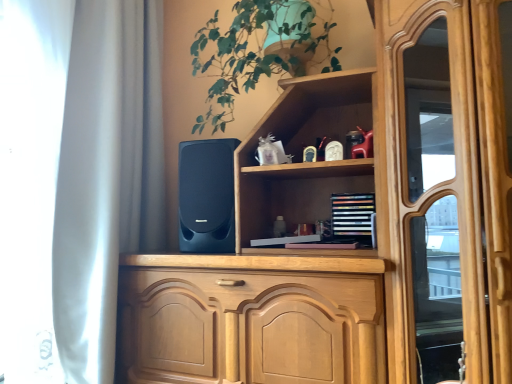
Question: Is the position of green leafy plant at upper center more distant than that of multicolored wooden bookshelf at upper center?

Choices:
 (A) yes
 (B) no

Answer: (B)

Question: Considering the relative sizes of green leafy plant at upper center and multicolored wooden bookshelf at upper center in the image provided, is green leafy plant at upper center taller than multicolored wooden bookshelf at upper center?

Choices:
 (A) yes
 (B) no

Answer: (A)

Question: Does green leafy plant at upper center appear on the left side of multicolored wooden bookshelf at upper center?

Choices:
 (A) yes
 (B) no

Answer: (A)

Question: Is green leafy plant at upper center oriented towards multicolored wooden bookshelf at upper center?

Choices:
 (A) no
 (B) yes

Answer: (A)

Question: From a real-world perspective, is green leafy plant at upper center beneath multicolored wooden bookshelf at upper center?

Choices:
 (A) no
 (B) yes

Answer: (A)

Question: Could multicolored wooden bookshelf at upper center be considered to be inside green leafy plant at upper center?

Choices:
 (A) no
 (B) yes

Answer: (A)

Question: Is matte black speaker at center located within multicolored wooden bookshelf at upper center?

Choices:
 (A) no
 (B) yes

Answer: (A)

Question: Is multicolored wooden bookshelf at upper center to the right of matte black speaker at center from the viewer's perspective?

Choices:
 (A) yes
 (B) no

Answer: (A)

Question: Is multicolored wooden bookshelf at upper center closer to the viewer compared to matte black speaker at center?

Choices:
 (A) yes
 (B) no

Answer: (B)

Question: Are multicolored wooden bookshelf at upper center and matte black speaker at center beside each other?

Choices:
 (A) yes
 (B) no

Answer: (B)

Question: Does multicolored wooden bookshelf at upper center come behind matte black speaker at center?

Choices:
 (A) no
 (B) yes

Answer: (B)

Question: Can you confirm if multicolored wooden bookshelf at upper center is taller than matte black speaker at center?

Choices:
 (A) no
 (B) yes

Answer: (A)

Question: From a real-world perspective, does matte black speaker at center stand above multicolored wooden bookshelf at upper center?

Choices:
 (A) yes
 (B) no

Answer: (A)